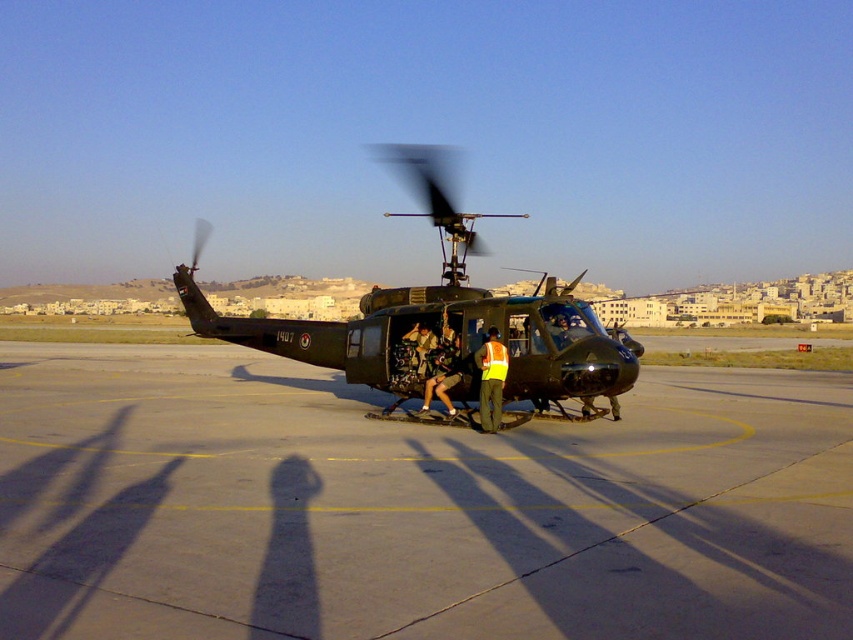
Does point (642, 454) come farther from viewer compared to point (486, 353)?

No, (642, 454) is closer to viewer.

Is concrete tarmac at center taller than reflective orange vest at center?

No.

Is point (672, 429) closer to viewer compared to point (490, 396)?

That is False.

This screenshot has height=640, width=853. What are the coordinates of `concrete tarmac at center` in the screenshot? It's located at (410, 508).

How far apart are concrete tarmac at center and matte black helicopter at center?

The distance of concrete tarmac at center from matte black helicopter at center is 10.21 meters.

This screenshot has height=640, width=853. Describe the element at coordinates (410, 508) in the screenshot. I see `concrete tarmac at center` at that location.

The width and height of the screenshot is (853, 640). I want to click on concrete tarmac at center, so click(x=410, y=508).

Where is `concrete tarmac at center`? This screenshot has width=853, height=640. concrete tarmac at center is located at coordinates (410, 508).

Is point (572, 394) behind point (428, 410)?

No, (572, 394) is in front of (428, 410).

This screenshot has width=853, height=640. Identify the location of matte black helicopter at center. (439, 317).